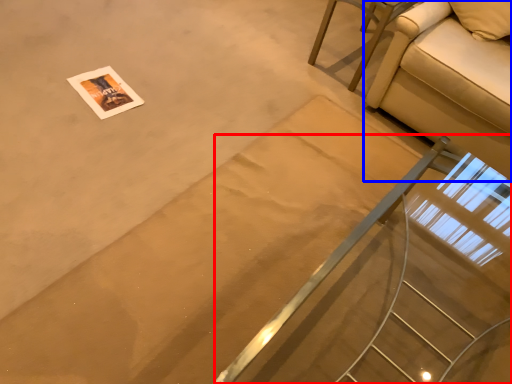
Question: Which point is closer to the camera, stairs (highlighted by a red box) or studio couch (highlighted by a blue box)?

Choices:
 (A) stairs
 (B) studio couch

Answer: (A)